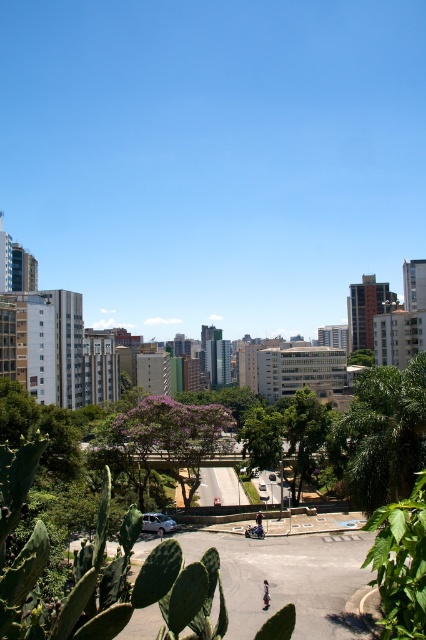
You are a pedestrian standing at the pedestrian crossing in the urban scene. You see a white matte van at center and dark blue jeans at center. Which object is closer to you?

The white matte van at center is positioned over dark blue jeans at center, meaning it is closer to you.

You are a drone operator who needs to capture aerial footage of the purple leafy tree at center. Your drone has a maximum flight range of 100 meters. Can your drone safely reach the tree without exceeding its range?

The distance between the purple leafy tree at center and the camera is 93.54 meters, which is within the drone operator drone has a maximum flight range of 100 meters. The drone can safely reach the tree without exceeding its range.

You are standing at the pedestrian crossing in the urban landscape and want to take a photo of both the point at coordinates point (143, 515) and point (267, 593). Which point should you focus on first to ensure both are in the frame?

You should focus on point (143, 515) first because it is closer to you than point (267, 593), ensuring both points are within the camera frame.